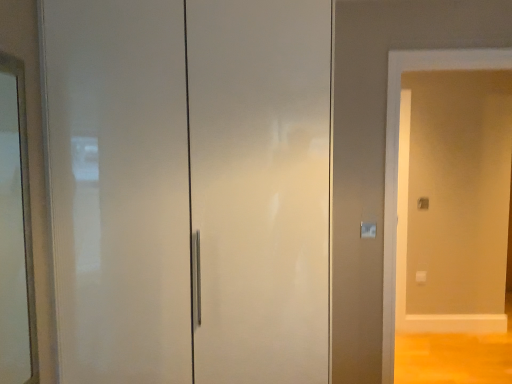
Question: Is matte white screen door at right located within white glossy door at center?

Choices:
 (A) no
 (B) yes

Answer: (A)

Question: Is white glossy door at center smaller than matte white screen door at right?

Choices:
 (A) no
 (B) yes

Answer: (A)

Question: Is matte white screen door at right at the back of white glossy door at center?

Choices:
 (A) yes
 (B) no

Answer: (B)

Question: From the image's perspective, is white glossy door at center below matte white screen door at right?

Choices:
 (A) no
 (B) yes

Answer: (A)

Question: Is white glossy door at center not close to matte white screen door at right?

Choices:
 (A) yes
 (B) no

Answer: (A)

Question: From the image's perspective, would you say white glossy door at center is positioned over matte white screen door at right?

Choices:
 (A) yes
 (B) no

Answer: (A)

Question: Is clear glass mirror at left directly adjacent to matte white screen door at right?

Choices:
 (A) yes
 (B) no

Answer: (B)

Question: Is clear glass mirror at left to the right of matte white screen door at right from the viewer's perspective?

Choices:
 (A) no
 (B) yes

Answer: (A)

Question: Can you confirm if clear glass mirror at left is taller than matte white screen door at right?

Choices:
 (A) yes
 (B) no

Answer: (B)

Question: Considering the relative sizes of clear glass mirror at left and matte white screen door at right in the image provided, is clear glass mirror at left shorter than matte white screen door at right?

Choices:
 (A) no
 (B) yes

Answer: (B)

Question: Is clear glass mirror at left not close to matte white screen door at right?

Choices:
 (A) no
 (B) yes

Answer: (B)

Question: Can you confirm if clear glass mirror at left is thinner than matte white screen door at right?

Choices:
 (A) no
 (B) yes

Answer: (B)

Question: Could you tell me if matte white screen door at right is turned towards white glossy door at center?

Choices:
 (A) no
 (B) yes

Answer: (A)